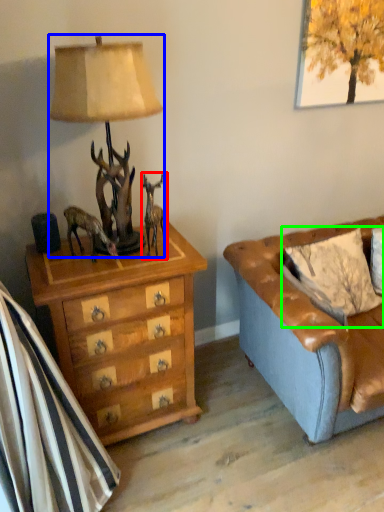
Question: Considering the real-world distances, which object is farthest from reindeer (highlighted by a red box)? lamp (highlighted by a blue box) or pillow (highlighted by a green box)?

Choices:
 (A) lamp
 (B) pillow

Answer: (B)